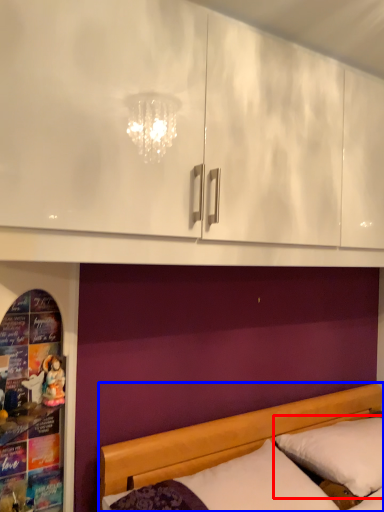
Question: Which object appears closest to the camera in this image, pillow (highlighted by a red box) or bed (highlighted by a blue box)?

Choices:
 (A) pillow
 (B) bed

Answer: (B)